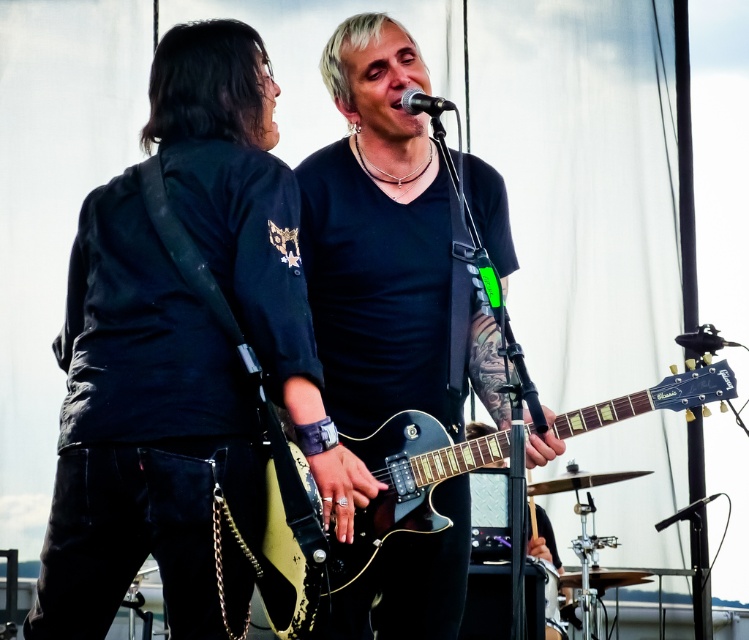
You are a stagehand setting up equipment for a concert. You have to place the matte black guitar at left and the black metallic microphone at center on a small table that can only hold items smaller than the microphone. Can both items fit on the table?

The matte black guitar at left is bigger than the black metallic microphone at center, so it cannot fit on the table since the table can only hold items smaller than the microphone. The microphone might fit, but the guitar cannot.

You are a photographer positioned at the back of the stage. You want to take a photo that clearly shows both the matte black guitar at left and the black metallic microphone at center. Which object should you focus on first to ensure both are in sharp focus?

The matte black guitar at left is closer to the viewer than the black metallic microphone at center. To ensure both are in sharp focus, focus on the matte black guitar at left first, as it is closer, and the microphone will fall within the depth of field.